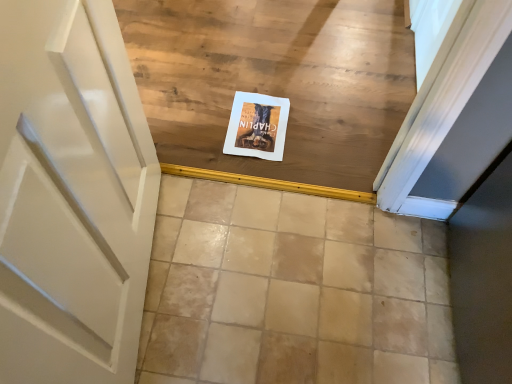
The image size is (512, 384). Describe the element at coordinates (292, 291) in the screenshot. I see `beige ceramic tile at center` at that location.

Where is `beige ceramic tile at center`? This screenshot has width=512, height=384. beige ceramic tile at center is located at coordinates (292, 291).

The width and height of the screenshot is (512, 384). Find the location of `white paper at center`. white paper at center is located at coordinates (257, 126).

Image resolution: width=512 pixels, height=384 pixels. What do you see at coordinates (257, 126) in the screenshot?
I see `white paper at center` at bounding box center [257, 126].

Where is `beige ceramic tile at center`? This screenshot has width=512, height=384. beige ceramic tile at center is located at coordinates (292, 291).

Considering the positions of objects white paper at center and beige ceramic tile at center in the image provided, who is more to the right, white paper at center or beige ceramic tile at center?

From the viewer's perspective, beige ceramic tile at center appears more on the right side.

Is white paper at center behind beige ceramic tile at center?

That is True.

Between point (248, 131) and point (186, 268), which one is positioned behind?

Point (248, 131)

From the image's perspective, which one is positioned higher, white paper at center or beige ceramic tile at center?

From the image's view, white paper at center is above.

From a real-world perspective, which object rests below the other?

beige ceramic tile at center, from a real-world perspective.

Which object is thinner, white paper at center or beige ceramic tile at center?

With smaller width is white paper at center.

Is white paper at center taller or shorter than beige ceramic tile at center?

Considering their sizes, white paper at center has less height than beige ceramic tile at center.

Is white paper at center smaller than beige ceramic tile at center?

Correct, white paper at center occupies less space than beige ceramic tile at center.

Can beige ceramic tile at center be found inside white paper at center?

No, beige ceramic tile at center is located outside of white paper at center.

Is white paper at center not close to beige ceramic tile at center?

white paper at center is actually quite close to beige ceramic tile at center.

Is white paper at center looking in the opposite direction of beige ceramic tile at center?

That's right, white paper at center is facing away from beige ceramic tile at center.

What's the angular difference between white paper at center and beige ceramic tile at center's facing directions?

white paper at center and beige ceramic tile at center are facing 175 degrees away from each other.

You are a GUI agent. You are given a task and a screenshot of the screen. Output one action in this format:
    pyautogui.click(x=<x>, y=<y>)
    Task: Click on the postcard located behind the beige ceramic tile at center
    
    Given the screenshot: What is the action you would take?
    pyautogui.click(x=257, y=126)

Based on their positions, is beige ceramic tile at center located to the left or right of white paper at center?

In the image, beige ceramic tile at center appears on the right side of white paper at center.

Which object is closer to the camera taking this photo, beige ceramic tile at center or white paper at center?

beige ceramic tile at center.

Between point (293, 290) and point (272, 105), which one is positioned behind?

Point (272, 105)

From the image's perspective, does beige ceramic tile at center appear lower than white paper at center?

Yes, from the image's perspective, beige ceramic tile at center is below white paper at center.

Looking at this image, from a real-world perspective, is beige ceramic tile at center physically above white paper at center?

No.

Consider the image. Looking at their sizes, would you say beige ceramic tile at center is wider or thinner than white paper at center?

beige ceramic tile at center is wider than white paper at center.

Between beige ceramic tile at center and white paper at center, which one has less height?

white paper at center is shorter.

Considering the relative sizes of beige ceramic tile at center and white paper at center in the image provided, is beige ceramic tile at center smaller than white paper at center?

Actually, beige ceramic tile at center might be larger than white paper at center.

Is beige ceramic tile at center inside or outside of white paper at center?

beige ceramic tile at center is located beyond the bounds of white paper at center.

Consider the image. Are beige ceramic tile at center and white paper at center located far from each other?

No, there isn't a large distance between beige ceramic tile at center and white paper at center.

Could you tell me if beige ceramic tile at center is turned towards white paper at center?

No, beige ceramic tile at center is not oriented towards white paper at center.

From the picture: What's the angular difference between beige ceramic tile at center and white paper at center's facing directions?

The angular difference between beige ceramic tile at center and white paper at center is 175 degrees.

Find the location of a particular element. ceramic tile in front of the white paper at center is located at coordinates (292, 291).

The height and width of the screenshot is (384, 512). I want to click on postcard positioned vertically above the beige ceramic tile at center (from a real-world perspective), so click(257, 126).

Locate an element on the screen. Image resolution: width=512 pixels, height=384 pixels. postcard lying above the beige ceramic tile at center (from the image's perspective) is located at coordinates (257, 126).